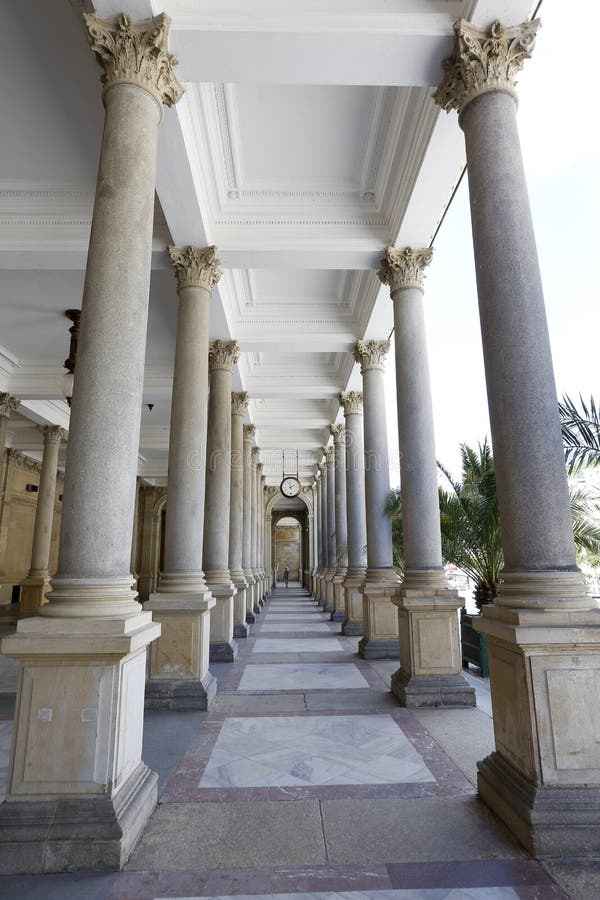
Locate an element on the screen. tile floor is located at coordinates (325, 804).